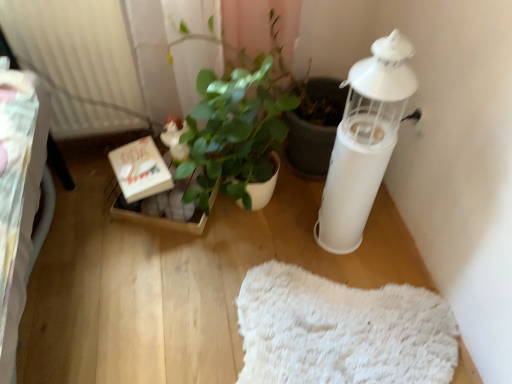
The width and height of the screenshot is (512, 384). I want to click on blank space above white fluffy mat at lower center (from a real-world perspective), so click(x=345, y=328).